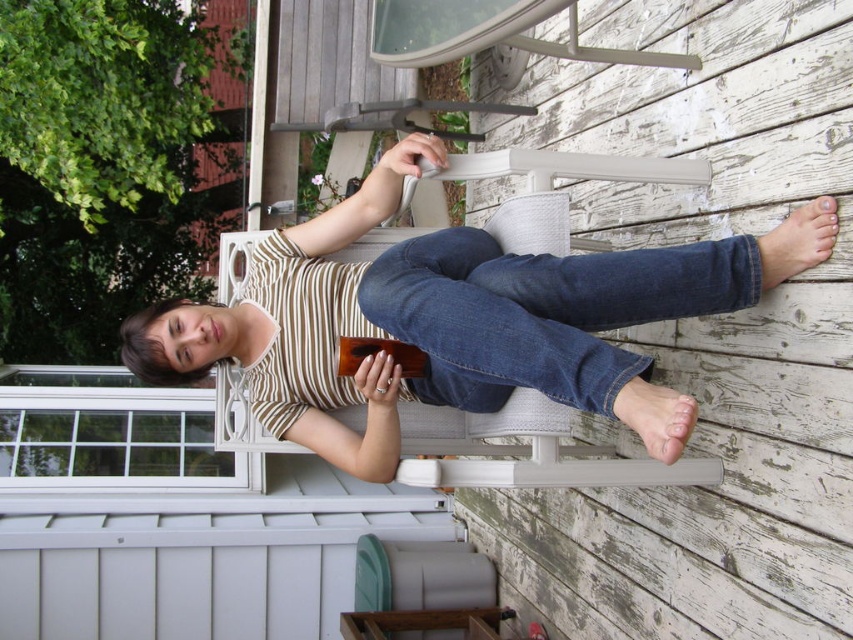
Question: Does striped cotton shirt at center lie in front of denim at lower right?

Choices:
 (A) no
 (B) yes

Answer: (B)

Question: Which point is farther to the camera?

Choices:
 (A) denim at lower right
 (B) striped cotton shirt at center

Answer: (A)

Question: Among these objects, which one is farthest from the camera?

Choices:
 (A) denim at lower right
 (B) striped cotton shirt at center

Answer: (A)

Question: Is striped cotton shirt at center to the right of denim at lower right from the viewer's perspective?

Choices:
 (A) yes
 (B) no

Answer: (B)

Question: Which of the following is the farthest from the observer?

Choices:
 (A) striped cotton shirt at center
 (B) denim at lower right

Answer: (B)

Question: Does striped cotton shirt at center have a larger size compared to denim at lower right?

Choices:
 (A) no
 (B) yes

Answer: (B)